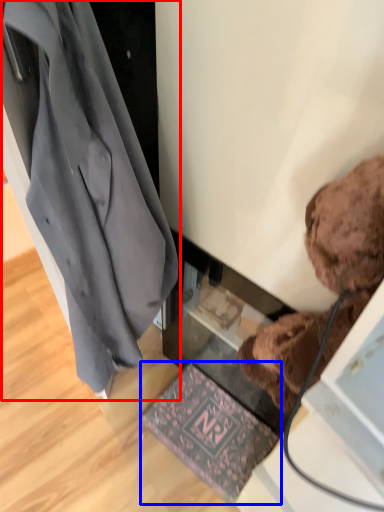
Question: Which object appears farthest to the camera in this image, coat (highlighted by a red box) or mat (highlighted by a blue box)?

Choices:
 (A) coat
 (B) mat

Answer: (B)